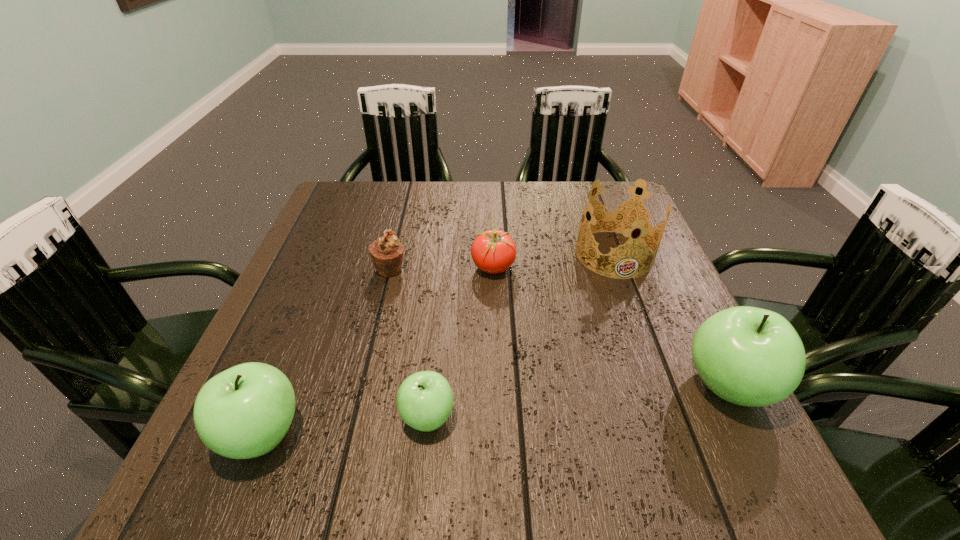
To achieve uniform spacing by inserting another apple among them, please point to a free space for this new apple. Please provide its 2D coordinates. Your answer should be formatted as a tuple, i.e. [(x, y)], where the tuple contains the x and y coordinates of a point satisfying the conditions above.

[(582, 401)]